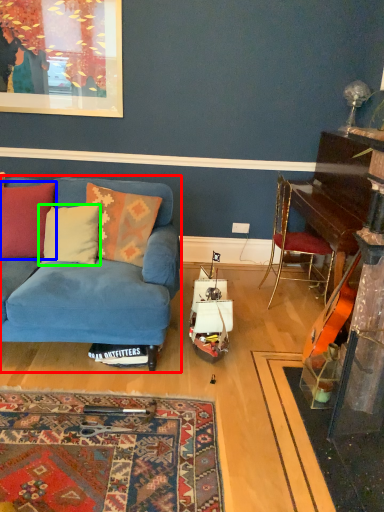
Question: Estimate the real-world distances between objects in this image. Which object is closer to studio couch (highlighted by a red box), pillow (highlighted by a blue box) or pillow (highlighted by a green box)?

Choices:
 (A) pillow
 (B) pillow

Answer: (B)